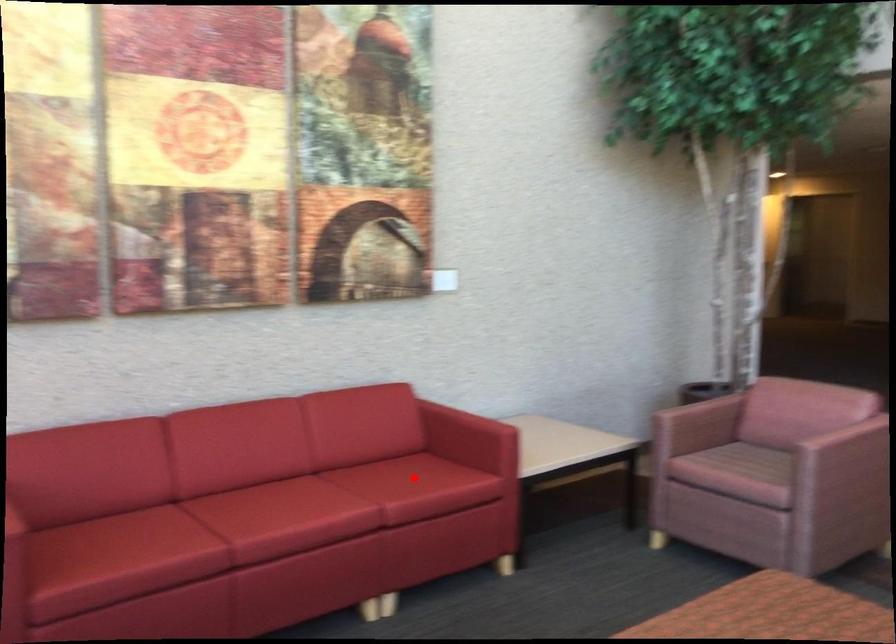
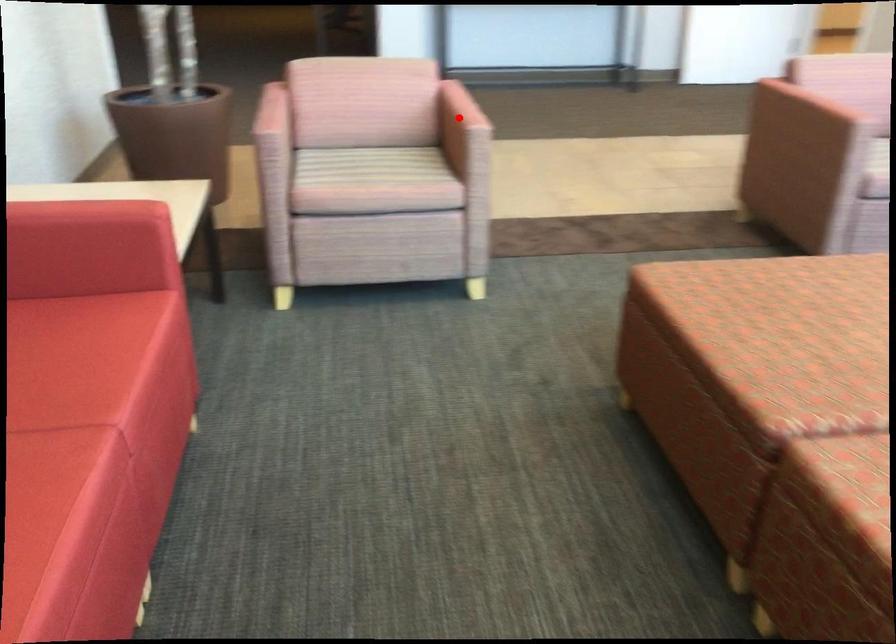
I am providing you with two images of the same scene from different viewpoints. A red point is marked on the first image and another point is marked on the second image. Does the point marked in image1 correspond to the same location as the one in image2?

No